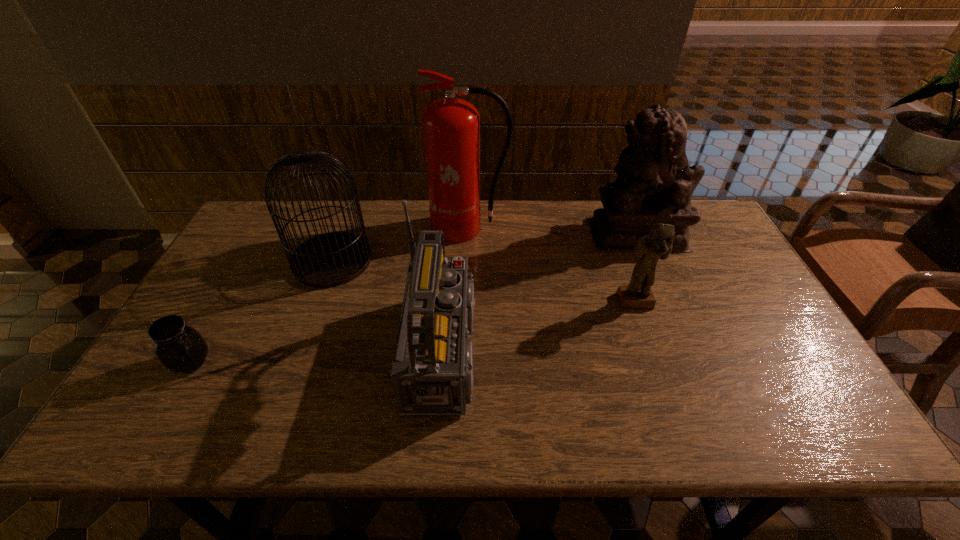
The height and width of the screenshot is (540, 960). I want to click on object positioned at the right edge, so click(655, 183).

I want to click on object that is at the far right corner, so click(655, 183).

This screenshot has height=540, width=960. Find the location of `vacant space at the far edge`. vacant space at the far edge is located at coordinates (571, 213).

Where is `free spot at the near edge of the desktop`? The width and height of the screenshot is (960, 540). free spot at the near edge of the desktop is located at coordinates (251, 424).

Find the location of a particular element. The width and height of the screenshot is (960, 540). free space at the left edge of the desktop is located at coordinates (239, 271).

At what (x,y) coordinates should I click in order to perform the action: click on free point at the right edge. Please return your answer as a coordinate pair (x, y). The height and width of the screenshot is (540, 960). Looking at the image, I should click on (770, 357).

Locate an element on the screen. free spot at the far left corner of the desktop is located at coordinates click(x=270, y=223).

What are the coordinates of `vacant space at the far right corner of the desktop` in the screenshot? It's located at (704, 233).

You are a GUI agent. You are given a task and a screenshot of the screen. Output one action in this format:
    pyautogui.click(x=<x>, y=<y>)
    Task: Click on the free space at the near right corner of the desktop
    Image resolution: width=960 pixels, height=540 pixels.
    Given the screenshot: What is the action you would take?
    pyautogui.click(x=821, y=417)

The height and width of the screenshot is (540, 960). Identify the location of vacant area between the tallest object and the shortest object. (330, 295).